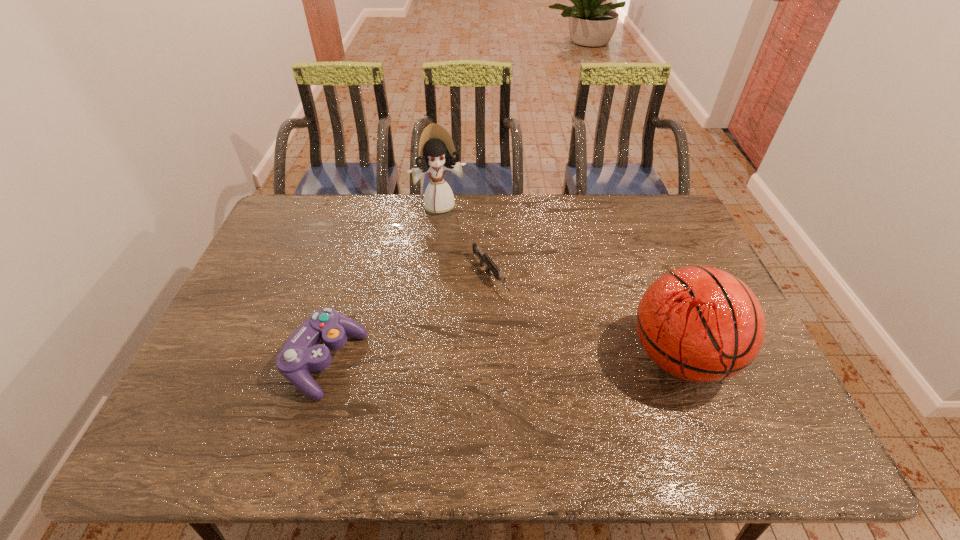
Locate an element on the screen. free location at the near edge is located at coordinates (495, 402).

Identify the location of free location at the left edge of the desktop. (275, 319).

The image size is (960, 540). In order to click on vacant area at the right edge in this screenshot , I will do `click(646, 241)`.

You are a GUI agent. You are given a task and a screenshot of the screen. Output one action in this format:
    pyautogui.click(x=<x>, y=<y>)
    Task: Click on the free region at the far left corner
    
    Given the screenshot: What is the action you would take?
    pyautogui.click(x=288, y=230)

In the image, there is a desktop. Identify the location of vacant space at the near right corner. (784, 413).

Locate an element on the screen. Image resolution: width=960 pixels, height=540 pixels. free space between the third object from right to left and the third object from left to right is located at coordinates (466, 241).

Find the location of a particular element. vacant area that lies between the leftmost object and the second object from right to left is located at coordinates (408, 319).

You are a GUI agent. You are given a task and a screenshot of the screen. Output one action in this format:
    pyautogui.click(x=<x>, y=<y>)
    Task: Click on the free space between the control and the basketball
    The height and width of the screenshot is (540, 960).
    Given the screenshot: What is the action you would take?
    pyautogui.click(x=502, y=360)

Locate an element on the screen. This screenshot has width=960, height=540. vacant region between the gun and the leftmost object is located at coordinates (408, 319).

The width and height of the screenshot is (960, 540). What are the coordinates of `vacant space that's between the gun and the leftmost object` in the screenshot? It's located at (408, 319).